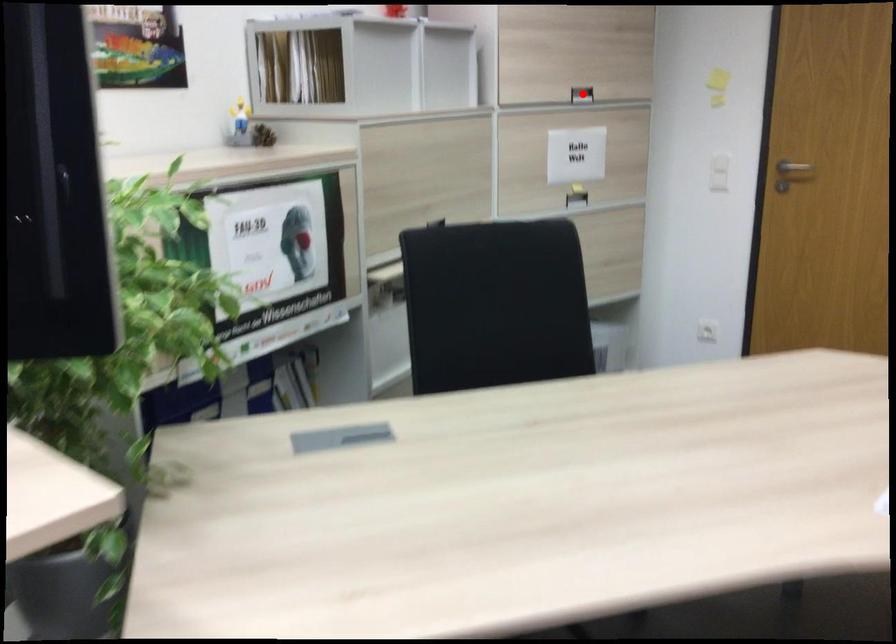
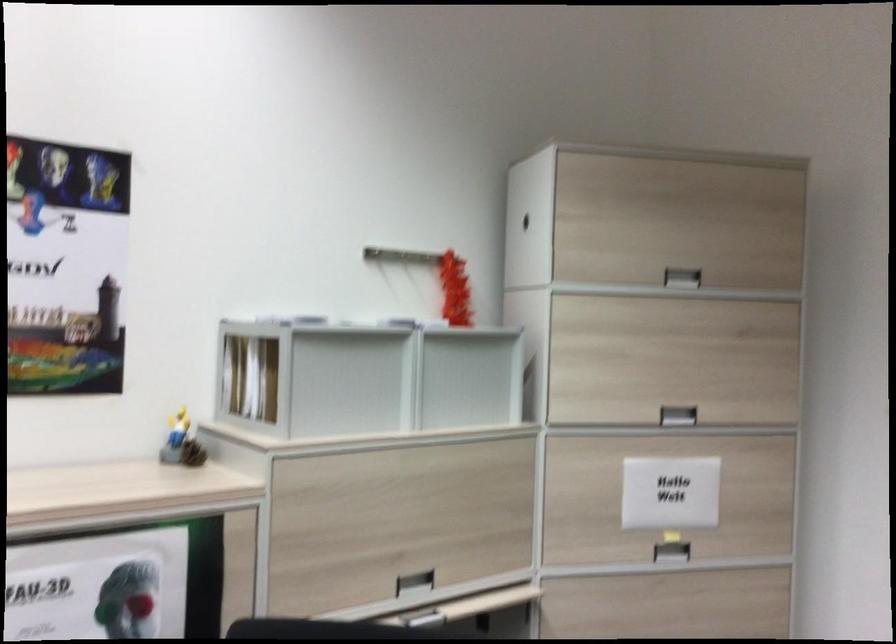
In the second image, find the point that corresponds to the highlighted location in the first image.

(677, 415)